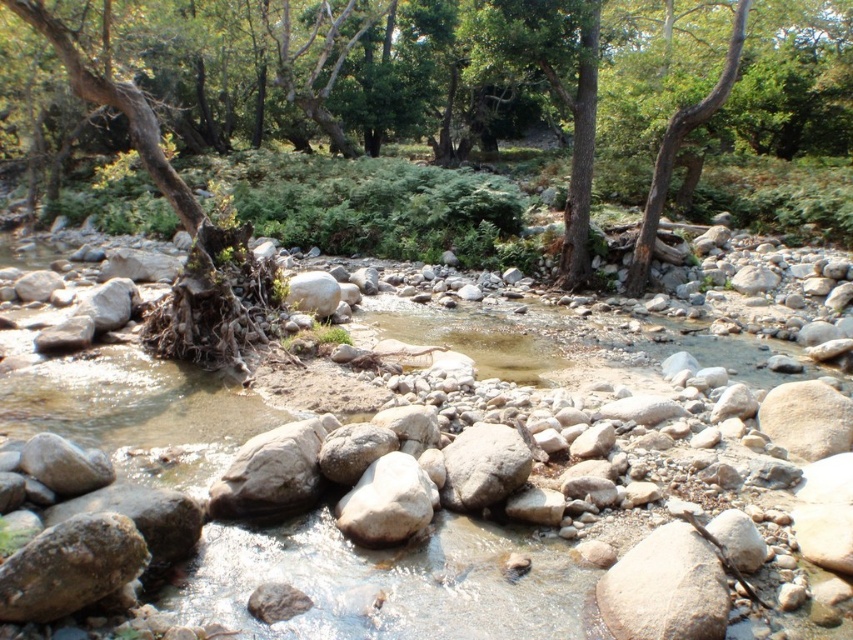
Question: Can you confirm if brown rough tree at center is positioned above brown rough tree trunk at left?

Choices:
 (A) yes
 (B) no

Answer: (A)

Question: Which of the following is the closest to the observer?

Choices:
 (A) smooth gray rock at center
 (B) clear water at center
 (C) brown rough tree trunk at left

Answer: (B)

Question: Considering the real-world distances, which object is closest to the brown rough tree trunk at left?

Choices:
 (A) brown rough tree at center
 (B) smooth gray rock at center
 (C) clear water at center

Answer: (C)

Question: Is brown rough tree at center thinner than brown rough tree trunk at left?

Choices:
 (A) no
 (B) yes

Answer: (A)

Question: Which of the following is the farthest from the observer?

Choices:
 (A) brown rough tree at center
 (B) brown rough tree trunk at left
 (C) clear water at center
 (D) smooth gray rock at center

Answer: (B)

Question: Does clear water at center appear under smooth gray rock at center?

Choices:
 (A) no
 (B) yes

Answer: (A)